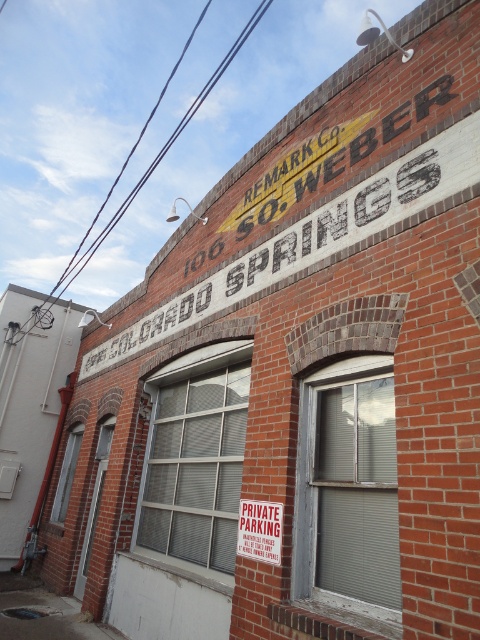
Question: Which point is closer to the camera taking this photo?

Choices:
 (A) (228, 385)
 (B) (256, 513)

Answer: (B)

Question: Which object is positioned farthest from the gray wooden window at center?

Choices:
 (A) clear glass window at lower left
 (B) clear glass window at center

Answer: (A)

Question: Is gray wooden window at center wider than clear glass window at center?

Choices:
 (A) yes
 (B) no

Answer: (B)

Question: Which point is farther from the camera taking this photo?

Choices:
 (A) (169, 369)
 (B) (312, 467)
 (C) (61, 492)

Answer: (C)

Question: Does white painted brick sign at upper center have a greater width compared to white painted text at upper center?

Choices:
 (A) no
 (B) yes

Answer: (A)

Question: Is gray wooden window at center in front of clear glass window at lower left?

Choices:
 (A) yes
 (B) no

Answer: (A)